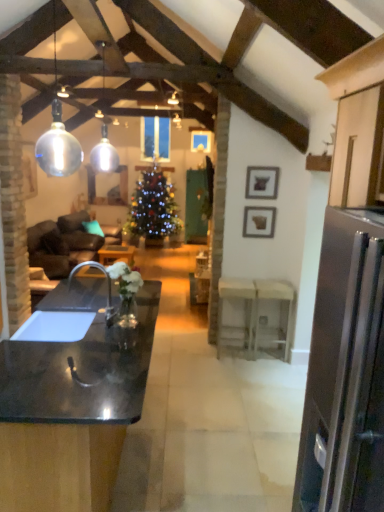
You are a GUI agent. You are given a task and a screenshot of the screen. Output one action in this format:
    pyautogui.click(x=<x>, y=<y>)
    Task: Click on the vacant space in transparent glass pendant light at upper left, the 2th lamp positioned from the back (from a real-world perspective)
    Image resolution: width=384 pixels, height=512 pixels.
    Given the screenshot: What is the action you would take?
    click(65, 364)